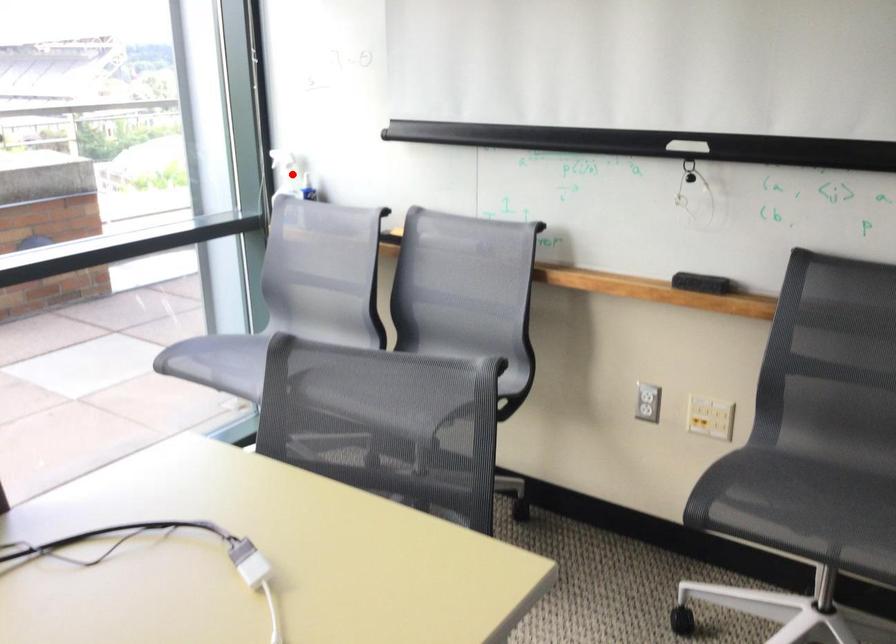
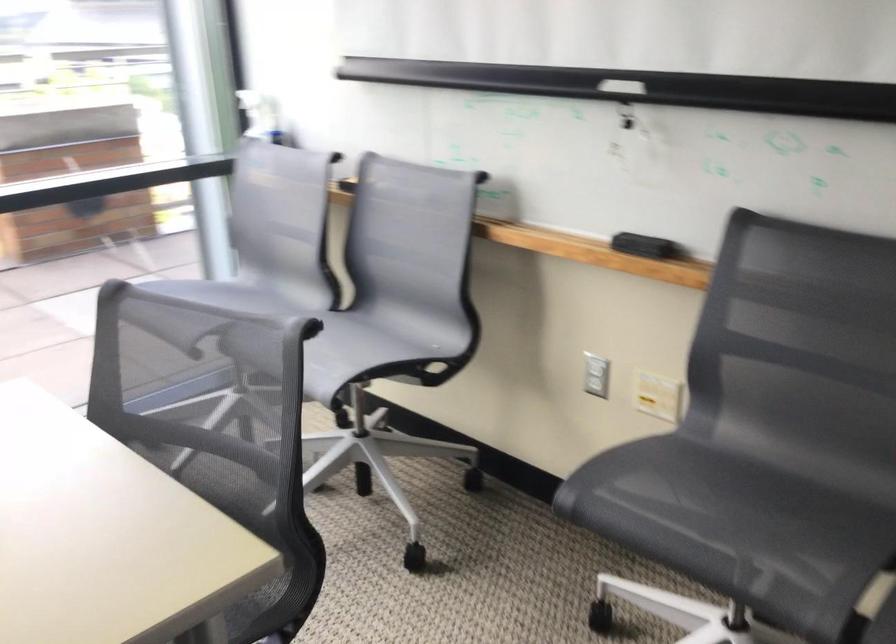
In the second image, find the point that corresponds to the highlighted location in the first image.

(260, 116)